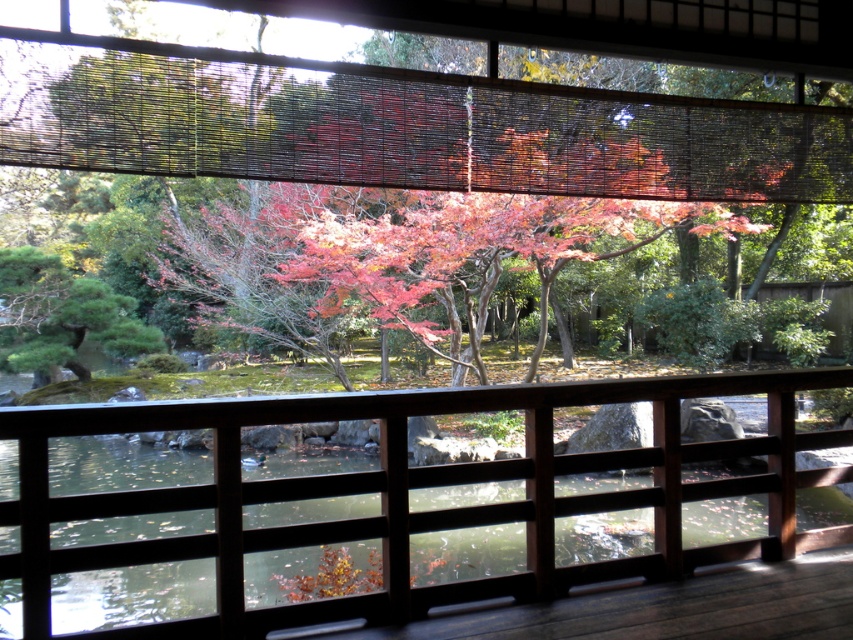
You are standing inside the traditional Japanese building and looking out through the wooden railing. You notice two points marked in the scene. Which point, point (711, 99) or point (314, 410), is closer to you?

Point (711, 99) is closer to you because it is further to the viewer than point (314, 410).

You are standing inside the traditional Japanese building and looking out through the wooden railing. There is a point marked at coordinates (421, 129). What is located at that point?

The point at coordinates (421, 129) marks autumn leaves at center.

You are standing inside the traditional Japanese building and looking through the brown wooden rail at center. You notice the autumn leaves at center in the distance. Can you determine which object appears larger in your view?

The autumn leaves at center appears smaller than the brown wooden rail at center, so the brown wooden rail at center looks larger in your view.